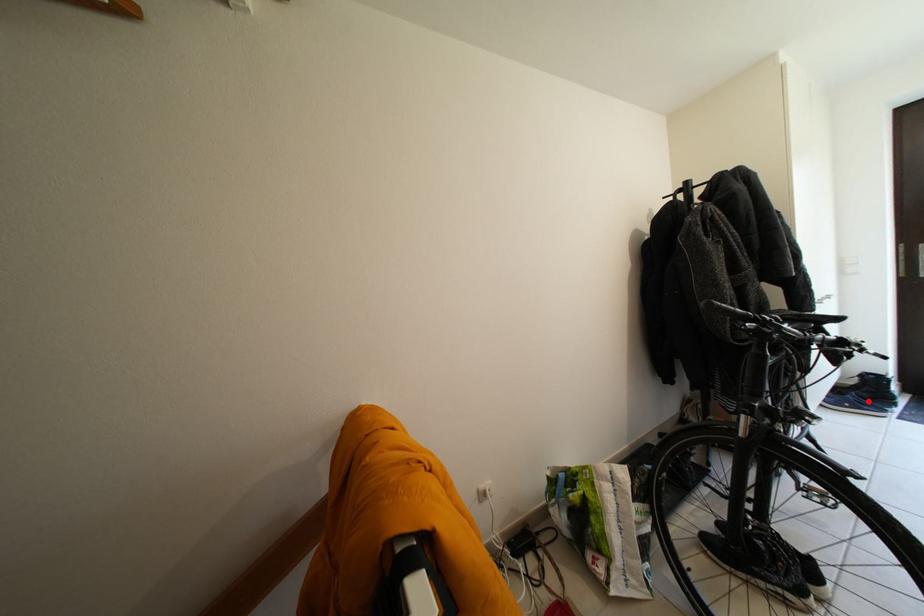
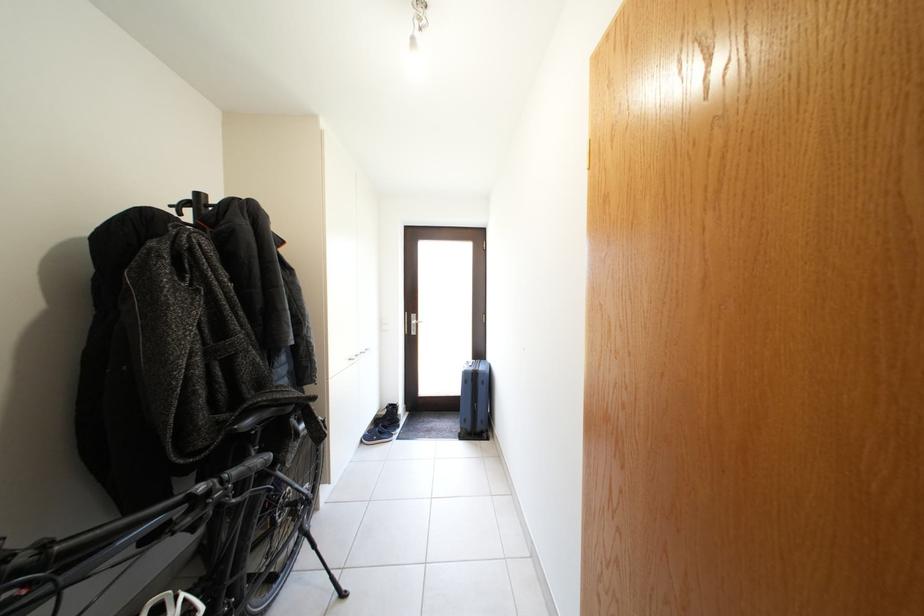
Find the pixel in the second image that matches the highlighted location in the first image.

(392, 431)